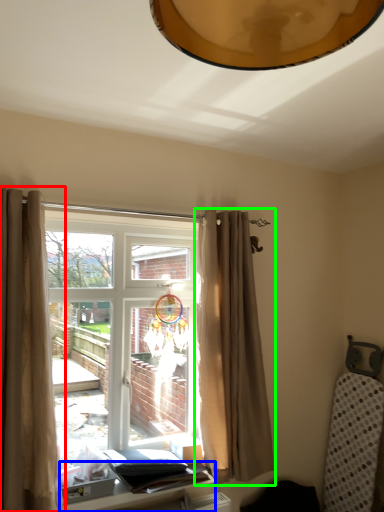
Question: Considering the real-world distances, which object is farthest from curtain (highlighted by a red box)? table (highlighted by a blue box) or curtain (highlighted by a green box)?

Choices:
 (A) table
 (B) curtain

Answer: (B)